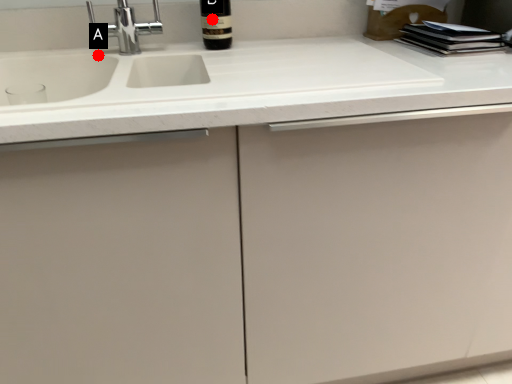
Question: Two points are circled on the image, labeled by A and B beside each circle. Among these points, which one is farthest from the camera?

Choices:
 (A) A is further
 (B) B is further

Answer: (A)